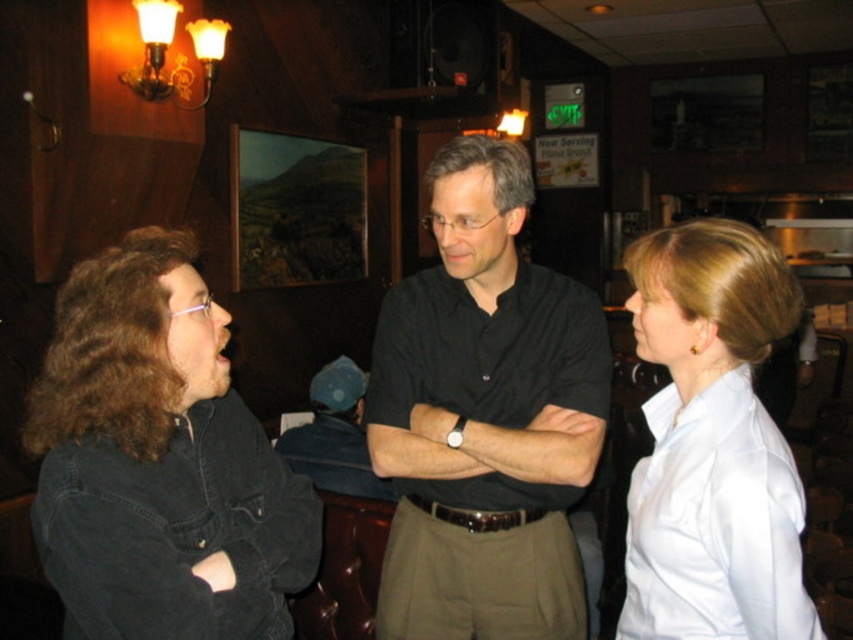
Question: Which object is closer to the camera taking this photo?

Choices:
 (A) white satin blouse at right
 (B) denim jacket at lower left

Answer: (B)

Question: Is denim jacket at lower left above white satin blouse at right?

Choices:
 (A) yes
 (B) no

Answer: (B)

Question: Is black matte shirt at center thinner than denim jacket at lower left?

Choices:
 (A) no
 (B) yes

Answer: (B)

Question: Among these objects, which one is farthest from the camera?

Choices:
 (A) black matte shirt at center
 (B) denim jacket at lower left
 (C) white satin blouse at right

Answer: (A)

Question: Which point is closer to the camera?

Choices:
 (A) (724, 586)
 (B) (520, 417)

Answer: (A)

Question: Is denim jacket at lower left wider than white satin blouse at right?

Choices:
 (A) yes
 (B) no

Answer: (A)